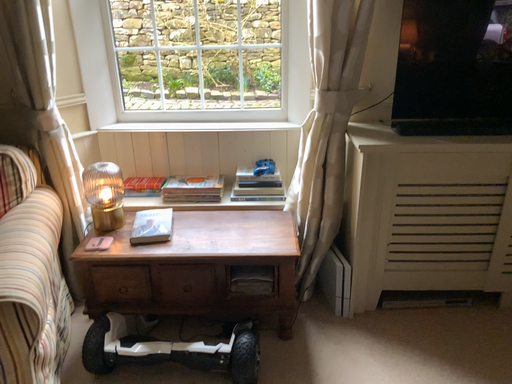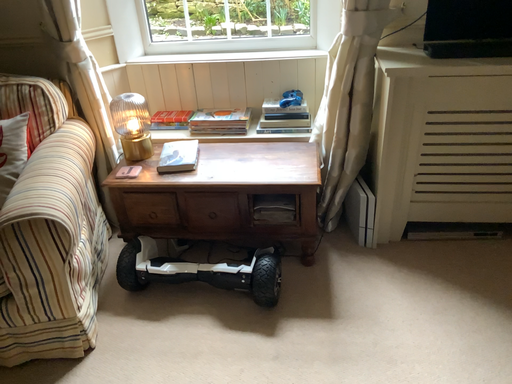
Question: How did the camera likely rotate when shooting the video?

Choices:
 (A) rotated downward
 (B) rotated upward

Answer: (A)